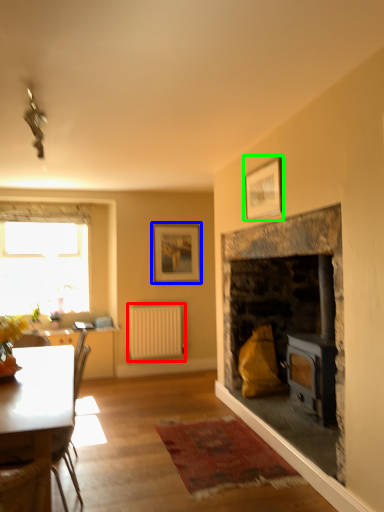
Question: Estimate the real-world distances between objects in this image. Which object is farther from radiator (highlighted by a red box), picture frame (highlighted by a blue box) or picture frame (highlighted by a green box)?

Choices:
 (A) picture frame
 (B) picture frame

Answer: (B)